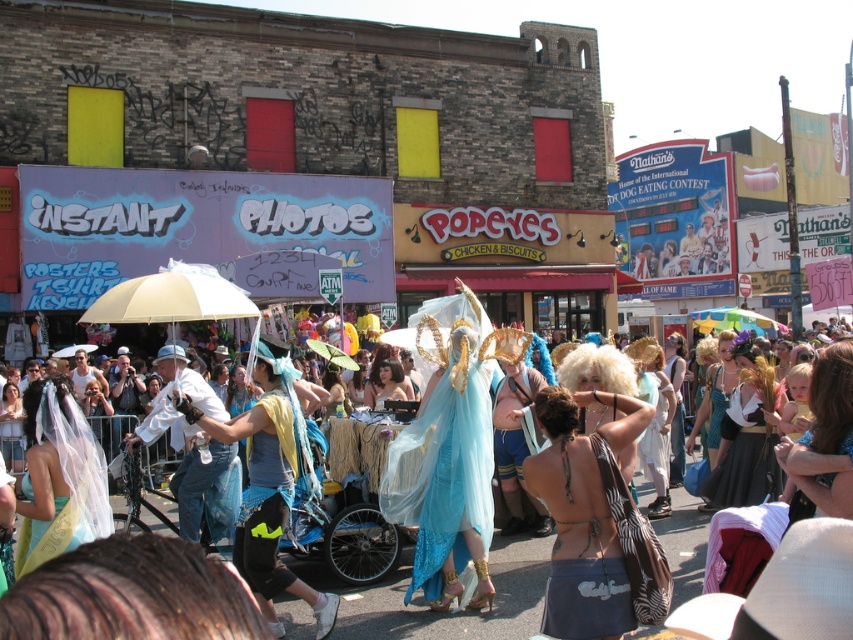
Question: Which object is the farthest from the rainbow fabric umbrella at center?

Choices:
 (A) white matte umbrella at center
 (B) blue fabric dress at center
 (C) beige fabric umbrella at center

Answer: (B)

Question: Is white matte umbrella at center wider than beige fabric umbrella at center?

Choices:
 (A) no
 (B) yes

Answer: (A)

Question: Does blue fabric dress at center have a greater width compared to beige fabric umbrella at center?

Choices:
 (A) no
 (B) yes

Answer: (A)

Question: Among these points, which one is farthest from the camera?

Choices:
 (A) (677, 529)
 (B) (756, 316)
 (C) (177, 285)

Answer: (B)

Question: Which is nearer to the beige fabric umbrella at center?

Choices:
 (A) translucent blue fabric at center
 (B) blue fabric dress at center

Answer: (B)

Question: Is translucent blue fabric at center thinner than rainbow fabric umbrella at center?

Choices:
 (A) no
 (B) yes

Answer: (A)